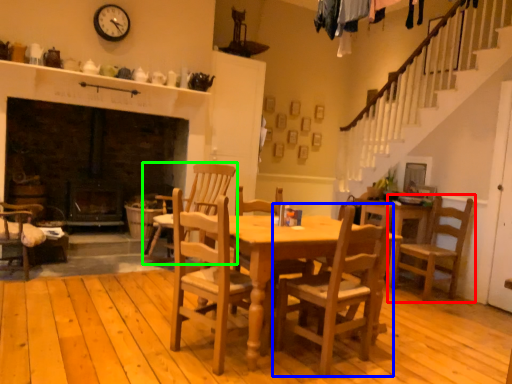
Question: Which object is positioned farthest from chair (highlighted by a red box)? Select from chair (highlighted by a blue box) and chair (highlighted by a green box).

Choices:
 (A) chair
 (B) chair

Answer: (B)